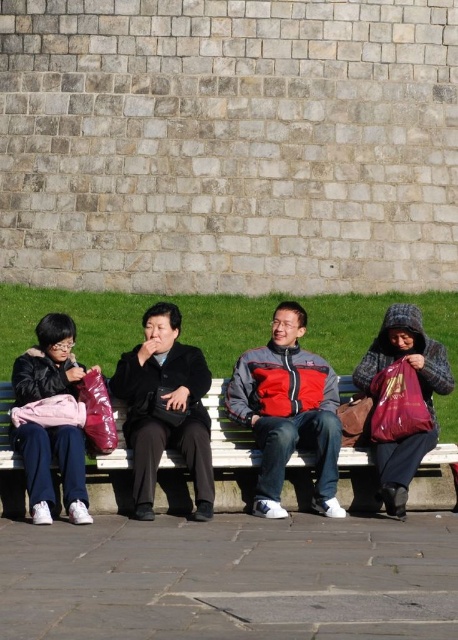
You are standing in front of the bench and want to find the person wearing the red and gray jacket at center. Which direction should you look relative to the person wearing the black matte coat at center?

The red and gray jacket at center is to the right of the black matte coat at center, so you should look to the right side of the person wearing the black matte coat at center to find them.

You are standing in front of the bench and want to sit next to the person wearing the red and gray jacket at center. Which side of the white wooden bench at center should you sit on to be closest to them?

You should sit on the right side of the white wooden bench at center because the white wooden bench at center is positioned on the left side of red and gray jacket at center, meaning the right side of the bench is closer to the jacket wearer.